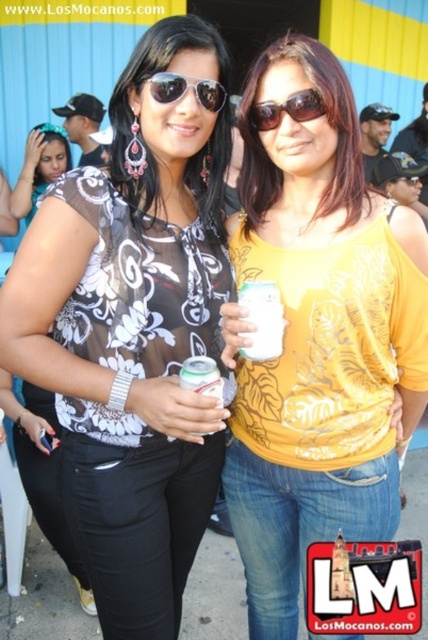
You are taking a photo of the two women in the image. The camera is focused on the point closer to it. Which of the two points, point (166,99) or point (273,106), will be in focus?

Point (166,99) is closer to the camera than point (273,106), so the camera will focus on point (166,99).

You are at a social gathering and want to take a photo of the two points mentioned. Which point is closer to you, point (160, 275) or point (308, 310)?

Point (160, 275) is closer to the viewer than point (308, 310), so you should focus on that point first for your photo.

You are at a casual outdoor event and see two people wearing the matte floral blouse at center and the yellow printed shirt at center. Which one is positioned more to the left?

The matte floral blouse at center is positioned more to the left than the yellow printed shirt at center.